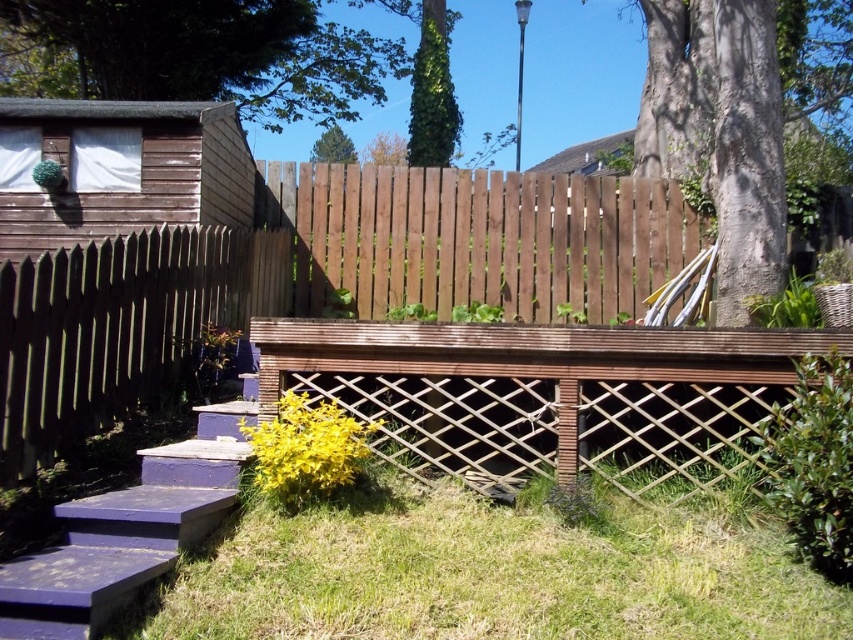
You are standing in the backyard and want to walk towards the brown wooden fence at center. Which direction should you move relative to the green grass at lower center?

The green grass at lower center is closer to the viewer than the brown wooden fence at center. To reach the brown wooden fence at center, you should move away from the green grass at lower center.